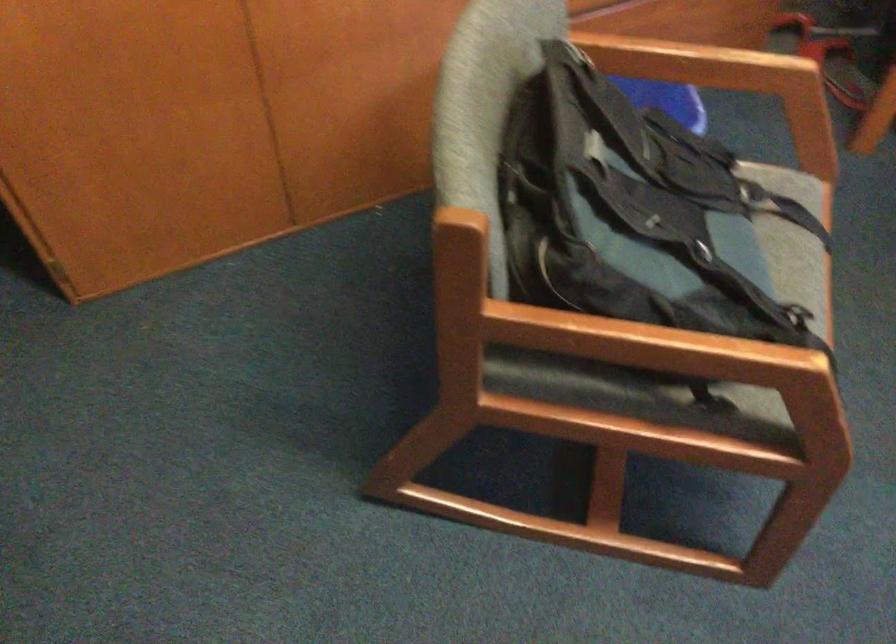
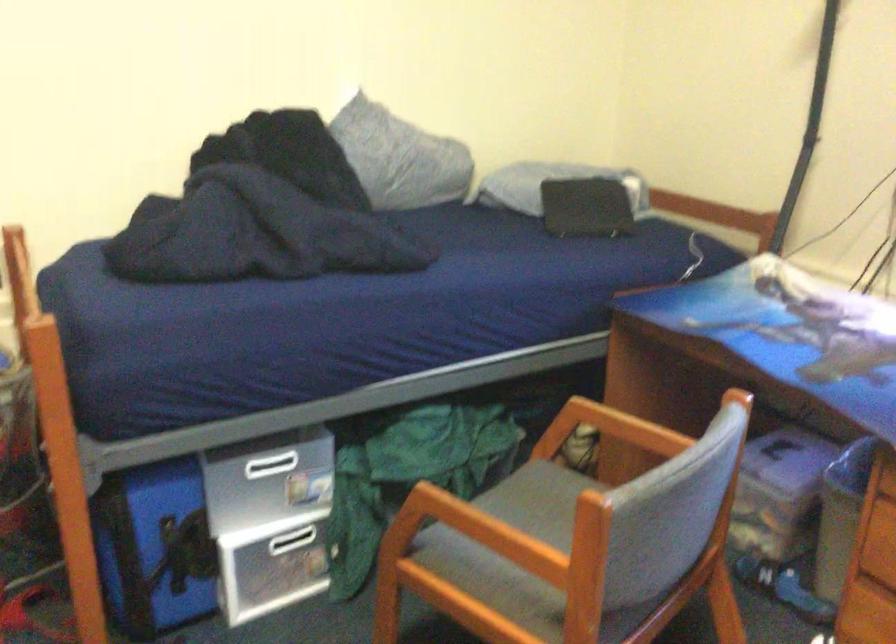
How did the camera likely rotate?

The camera rotated toward right-up.